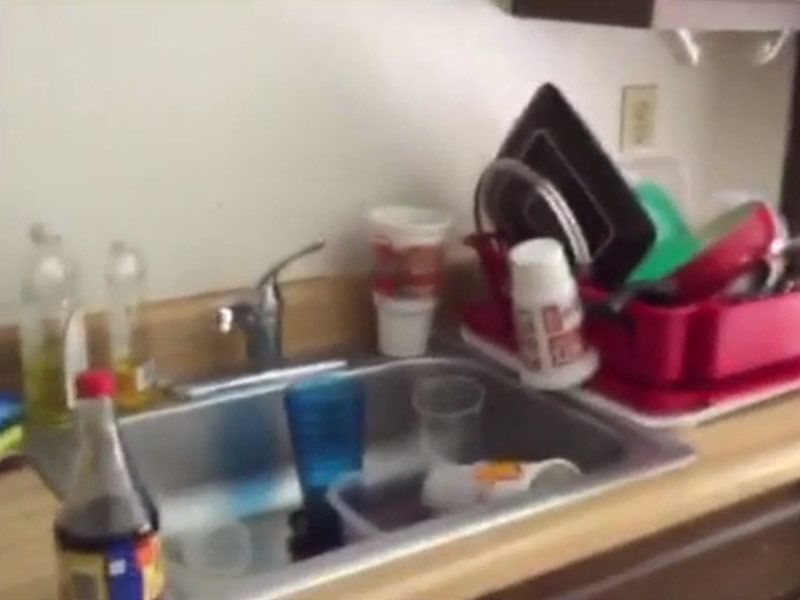
Find the location of `sink handle`. sink handle is located at coordinates (312, 247).